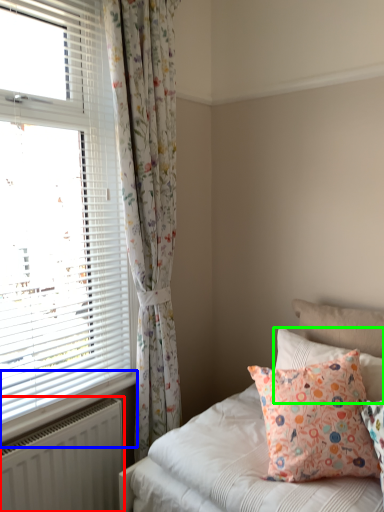
Question: Estimate the real-world distances between objects in this image. Which object is farther from radiator (highlighted by a red box), window sill (highlighted by a blue box) or pillow (highlighted by a green box)?

Choices:
 (A) window sill
 (B) pillow

Answer: (B)